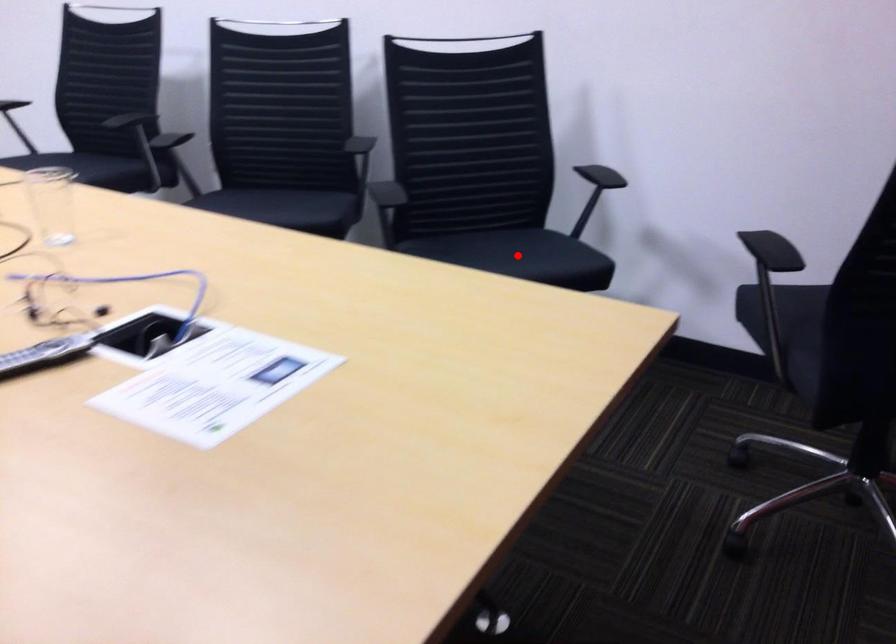
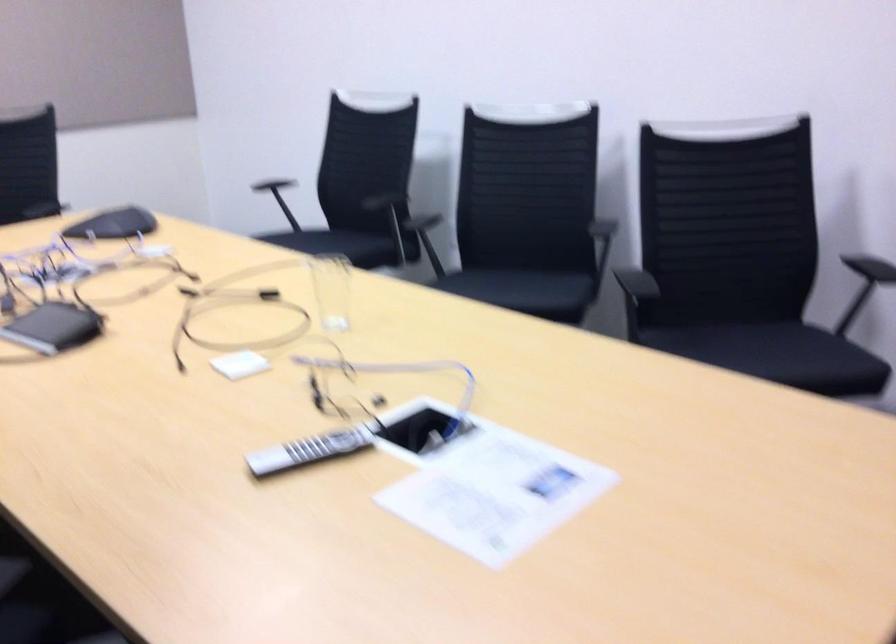
Find the pixel in the second image that matches the highlighted location in the first image.

(778, 355)